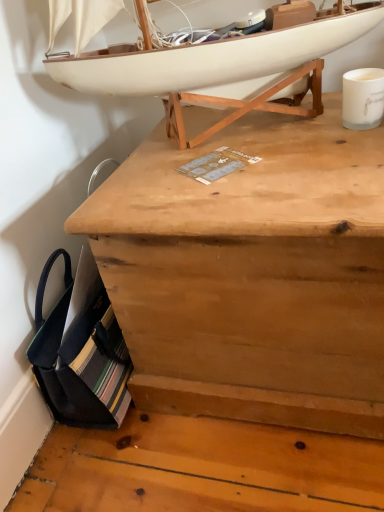
This screenshot has height=512, width=384. I want to click on free spot above natural wood chest at center (from a real-world perspective), so click(x=261, y=145).